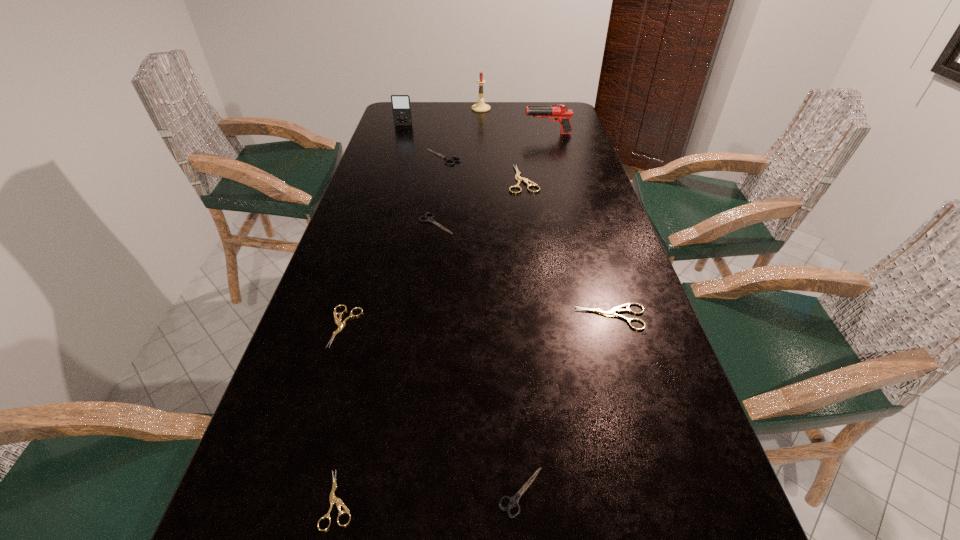
Where is `the tallest object`? This screenshot has width=960, height=540. the tallest object is located at coordinates (480, 106).

The height and width of the screenshot is (540, 960). Identify the location of the farthest object. (480, 106).

Image resolution: width=960 pixels, height=540 pixels. I want to click on the ninth nearest object, so click(x=401, y=107).

Find the location of a particular element. Image resolution: width=960 pixels, height=540 pixels. the third farthest object is located at coordinates (561, 114).

Locate an element on the screen. The image size is (960, 540). gun is located at coordinates (561, 114).

Identify the location of the farthest black shears. (446, 158).

Identify the location of the third beige shears from left to right. (518, 178).

I want to click on the farthest beige shears, so click(518, 178).

Locate an element on the screen. The width and height of the screenshot is (960, 540). the fifth nearest shears is located at coordinates (430, 219).

The image size is (960, 540). Identify the location of the second farthest black shears. (430, 219).